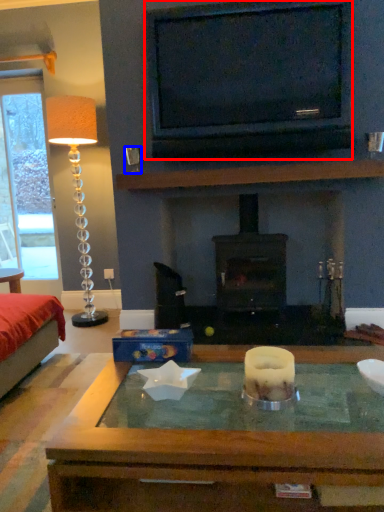
Question: Which object appears closest to the camera in this image, television (highlighted by a red box) or coffee cup (highlighted by a blue box)?

Choices:
 (A) television
 (B) coffee cup

Answer: (A)